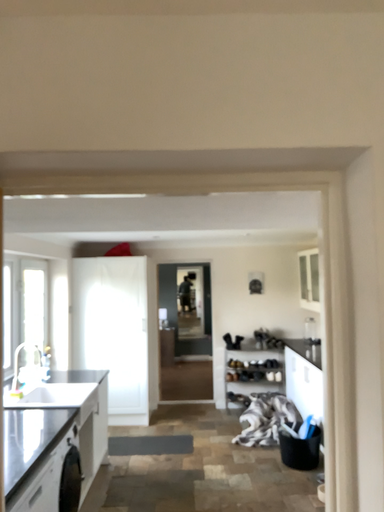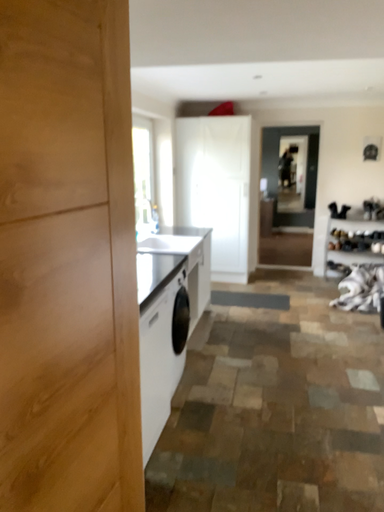
Question: Which way did the camera rotate in the video?

Choices:
 (A) rotated upward
 (B) rotated downward

Answer: (B)